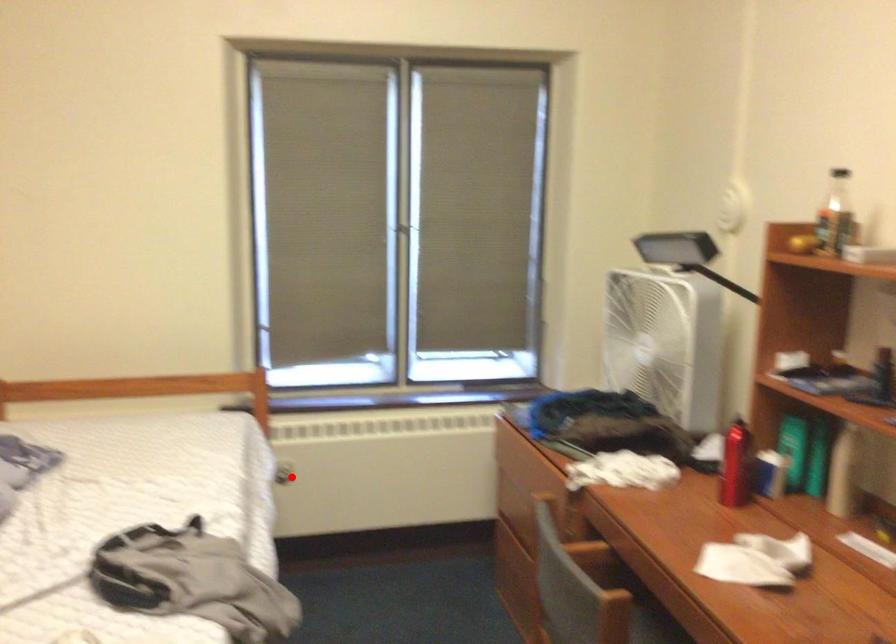
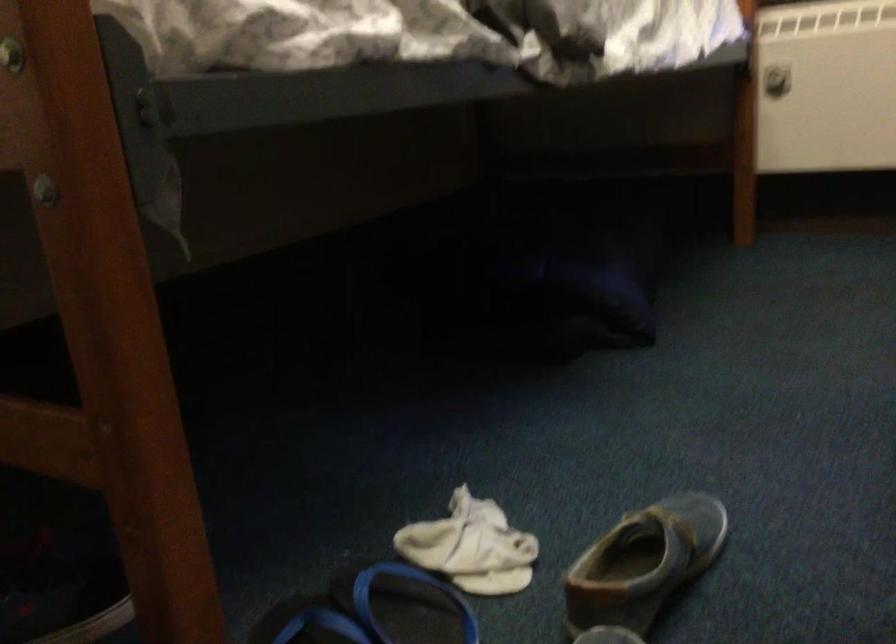
Question: I am providing you with two images of the same scene from different viewpoints. A red point is shown in image1. For the corresponding object point in image2, is it positioned nearer or farther from the camera?

Choices:
 (A) Nearer
 (B) Farther

Answer: (A)